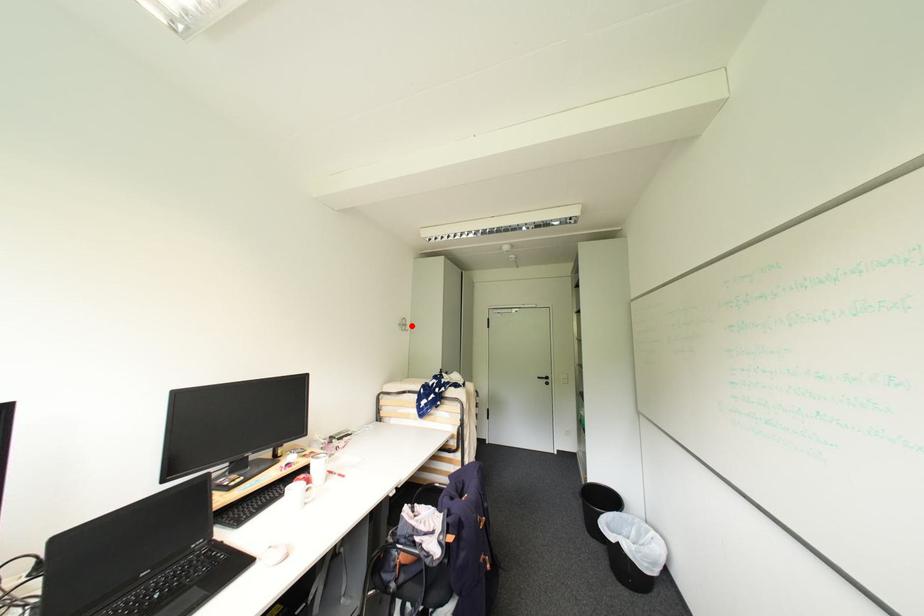
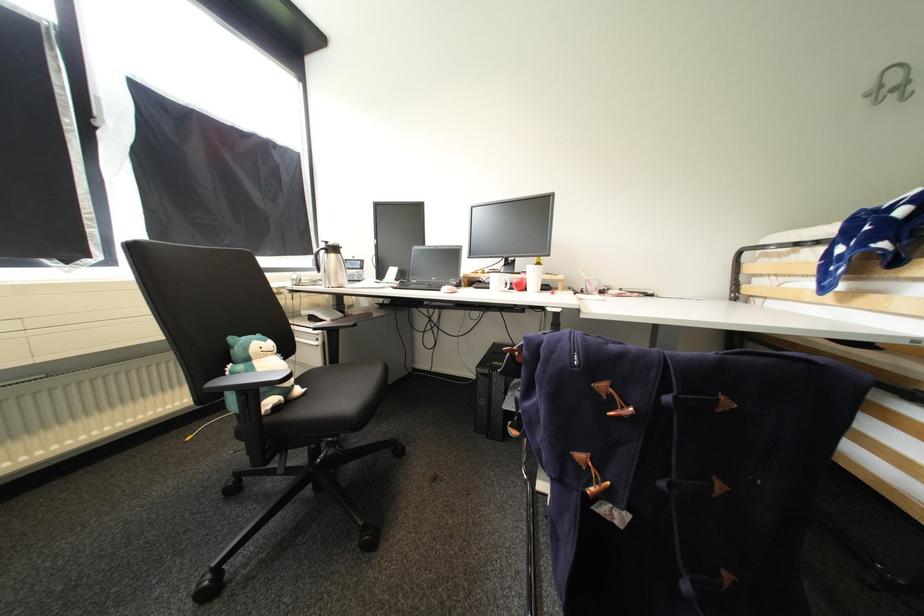
Where in the second image is the point corresponding to the highlighted location from the first image?

(912, 84)